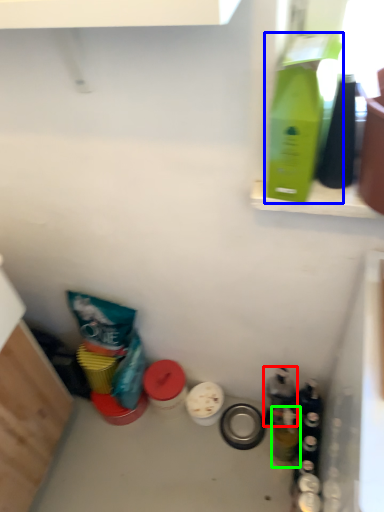
Question: Which object is the farthest from bottle (highlighted by a red box)? Choose among these: bottle (highlighted by a blue box) or bottle (highlighted by a green box).

Choices:
 (A) bottle
 (B) bottle

Answer: (A)